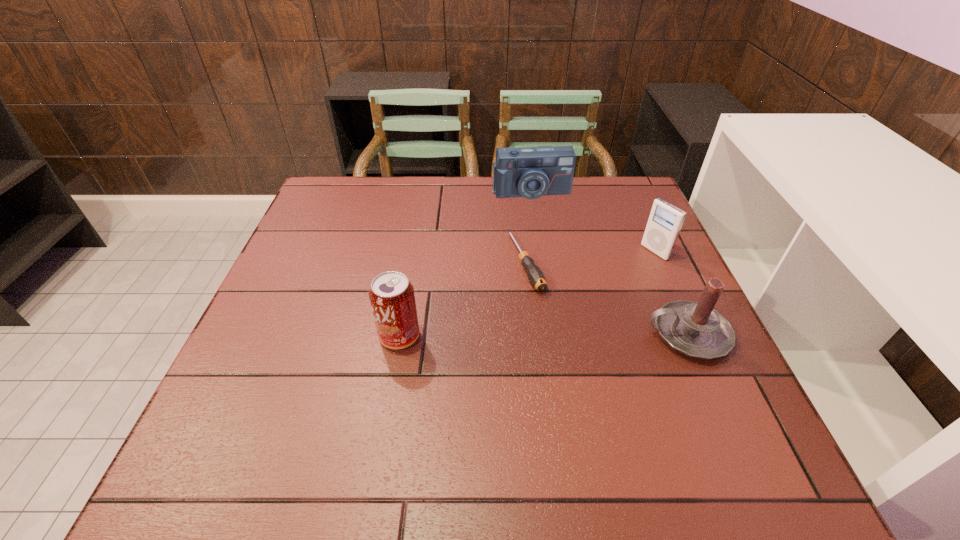
Where is `vacant region located 0.220m on the front-facing side of the iPod`? vacant region located 0.220m on the front-facing side of the iPod is located at coordinates (587, 292).

Locate an element on the screen. This screenshot has height=540, width=960. vacant area situated on the front-facing side of the iPod is located at coordinates (531, 323).

At what (x,y) coordinates should I click in order to perform the action: click on vacant space located 0.270m at the tip of the screwdriver. Please return your answer as a coordinate pair (x, y). Looking at the image, I should click on (588, 388).

Image resolution: width=960 pixels, height=540 pixels. What are the coordinates of `vacant region located 0.200m at the tip of the screwdriver` in the screenshot? It's located at (571, 360).

The width and height of the screenshot is (960, 540). Identify the location of free space located 0.120m at the tip of the screwdriver. (555, 330).

Identify the location of vacant space located on the lens of the farthest object. (557, 282).

You are a GUI agent. You are given a task and a screenshot of the screen. Output one action in this format:
    pyautogui.click(x=<x>, y=<y>)
    Task: Click on the free space located on the lens of the farthest object
    
    Given the screenshot: What is the action you would take?
    pyautogui.click(x=550, y=258)

I want to click on blank area located on the lens of the farthest object, so click(540, 219).

Where is `object at the far edge`? object at the far edge is located at coordinates (531, 172).

Where is `candle positioned at the right edge`? The height and width of the screenshot is (540, 960). candle positioned at the right edge is located at coordinates (695, 329).